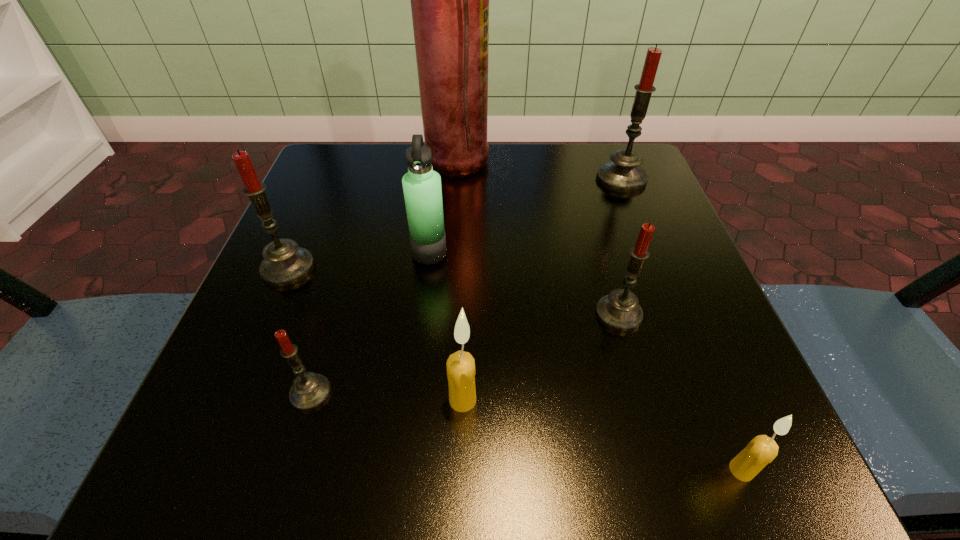
You are a GUI agent. You are given a task and a screenshot of the screen. Output one action in this format:
    pyautogui.click(x=<x>, y=<y>)
    Task: Click on the free space that is in between the smallest red candle and the thermos bottle
    This screenshot has width=960, height=540.
    Given the screenshot: What is the action you would take?
    pyautogui.click(x=371, y=323)

Locate an element on the screen. Image resolution: width=960 pixels, height=540 pixels. free point between the leftmost red candle and the red fire extinguisher is located at coordinates (371, 216).

Find the location of a particular element. free space between the fifth farthest object and the fifth nearest candle is located at coordinates (453, 291).

Select which object appears as the sixth closest to the second farthest candle. Please provide its 2D coordinates. Your answer should be formatted as a tuple, i.e. [(x, y)], where the tuple contains the x and y coordinates of a point satisfying the conditions above.

[(623, 173)]

Identify which object is the nearest to the leftmost red candle. Please provide its 2D coordinates. Your answer should be formatted as a tuple, i.e. [(x, y)], where the tuple contains the x and y coordinates of a point satisfying the conditions above.

[(422, 190)]

Select which candle appears as the sixth closest to the thermos bottle. Please provide its 2D coordinates. Your answer should be formatted as a tuple, i.e. [(x, y)], where the tuple contains the x and y coordinates of a point satisfying the conditions above.

[(760, 451)]

In order to click on candle that can be found as the third closest to the nearest object in this screenshot , I will do tap(309, 390).

Where is `the closest red candle relative to the tallest object`? the closest red candle relative to the tallest object is located at coordinates (623, 173).

Select which red candle is the third closest to the smallest red candle. Please provide its 2D coordinates. Your answer should be formatted as a tuple, i.e. [(x, y)], where the tuple contains the x and y coordinates of a point satisfying the conditions above.

[(623, 173)]

Where is `vacant area in the image that satisfies the following two spatial constraints: 1. on the back side of the second tallest object; 2. on the left side of the second smallest red candle`? The width and height of the screenshot is (960, 540). vacant area in the image that satisfies the following two spatial constraints: 1. on the back side of the second tallest object; 2. on the left side of the second smallest red candle is located at coordinates (581, 179).